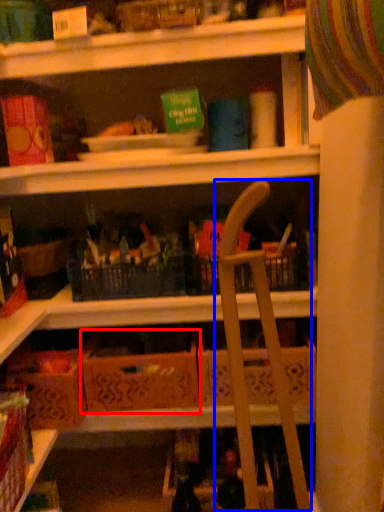
Question: Which object is further to the camera taking this photo, cardboard box (highlighted by a red box) or folding chair (highlighted by a blue box)?

Choices:
 (A) cardboard box
 (B) folding chair

Answer: (A)